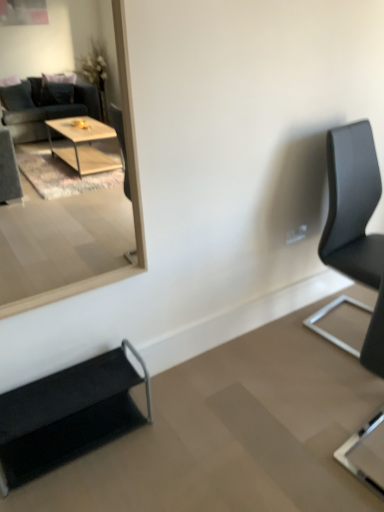
Question: Is wooden frame mirror at upper left taller or shorter than black fabric chair at lower left, marked as the 1th chair in a left-to-right arrangement?

Choices:
 (A) tall
 (B) short

Answer: (A)

Question: From the image's perspective, is wooden frame mirror at upper left located above or below black fabric chair at lower left, the 3th chair positioned from the right?

Choices:
 (A) below
 (B) above

Answer: (B)

Question: Which is nearer to the black fabric chair at lower left, marked as the 1th chair in a left-to-right arrangement?

Choices:
 (A) black leather chair at right, which is counted as the second chair, starting from the right
 (B) wooden frame mirror at upper left
 (C) black leather chair at right, the first chair from the right

Answer: (A)

Question: Which object is the farthest from the black fabric chair at lower left, the 3th chair positioned from the right?

Choices:
 (A) wooden frame mirror at upper left
 (B) black leather chair at right, the first chair from the right
 (C) black leather chair at right, the 2th chair positioned from the left

Answer: (A)